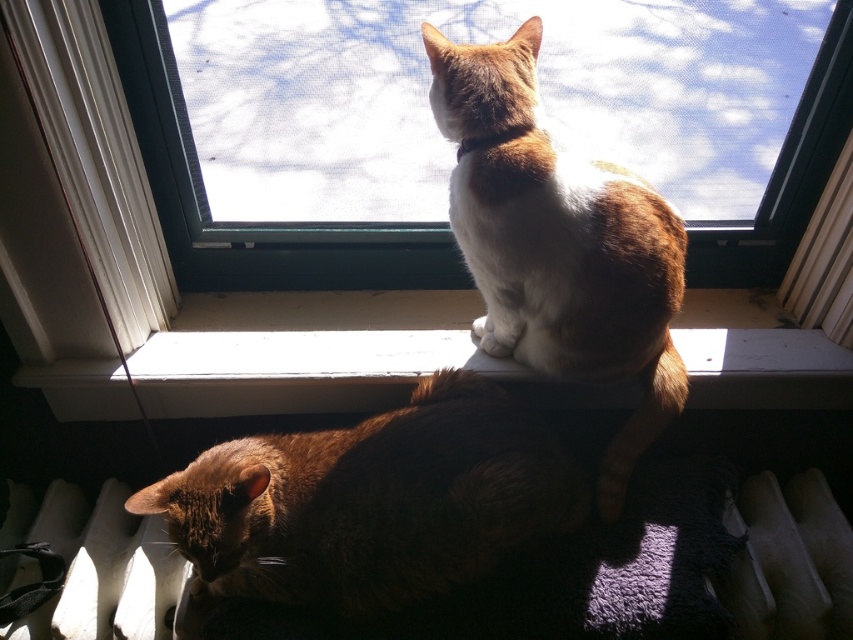
Who is shorter, dark brown fur cat at lower center or white smooth window sill at center?

Standing shorter between the two is white smooth window sill at center.

Is point (453, 584) farther from camera compared to point (393, 339)?

No, (453, 584) is in front of (393, 339).

Between point (173, 518) and point (755, 296), which one is positioned in front?

Positioned in front is point (173, 518).

At what (x,y) coordinates should I click in order to perform the action: click on dark brown fur cat at lower center. Please return your answer as a coordinate pair (x, y). This screenshot has width=853, height=640. Looking at the image, I should click on (372, 500).

Can you confirm if transparent glass window at upper center is positioned above dark brown fur cat at lower center?

Indeed, transparent glass window at upper center is positioned over dark brown fur cat at lower center.

The width and height of the screenshot is (853, 640). I want to click on transparent glass window at upper center, so click(213, 292).

Is transparent glass window at upper center positioned in front of white soft fur cat at upper center?

That is True.

Is transparent glass window at upper center shorter than white soft fur cat at upper center?

Indeed, transparent glass window at upper center has a lesser height compared to white soft fur cat at upper center.

This screenshot has height=640, width=853. In order to click on transparent glass window at upper center in this screenshot , I will do `click(213, 292)`.

The width and height of the screenshot is (853, 640). Find the location of `transparent glass window at upper center`. transparent glass window at upper center is located at coordinates (x=213, y=292).